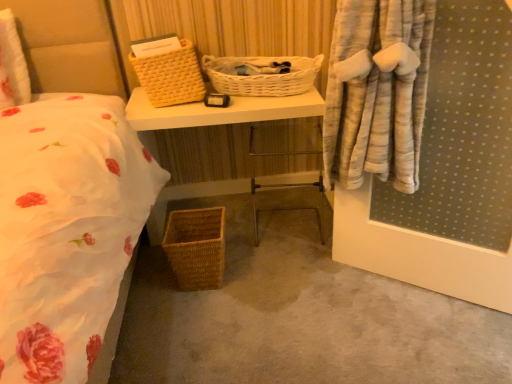
Locate an element on the screen. vacant space positioned to the left of woven brown picnic basket at lower center, the 1th picnic basket from the bottom is located at coordinates (148, 283).